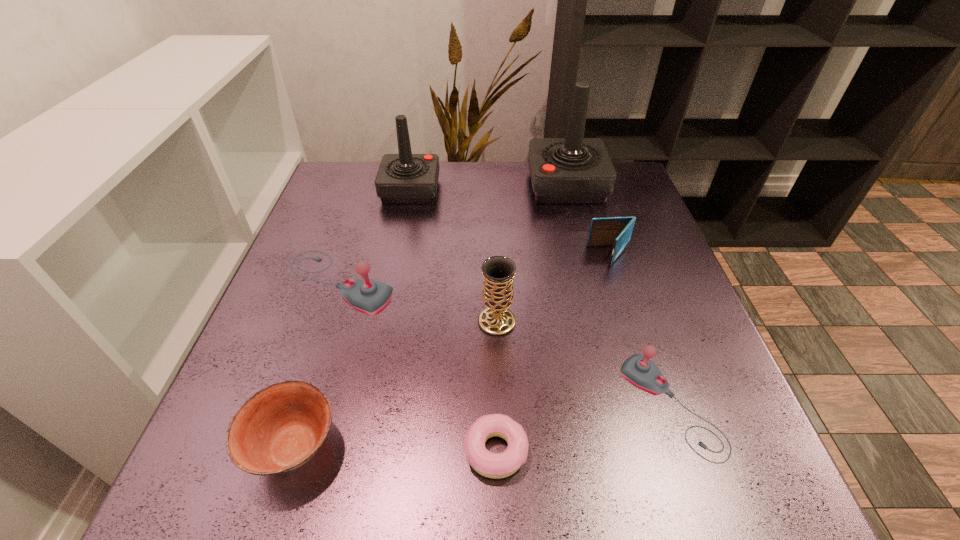
Locate an element on the screen. This screenshot has width=960, height=540. vacant region between the second tallest joystick and the third tallest object is located at coordinates (453, 255).

Find the location of a particular element. Image resolution: width=960 pixels, height=540 pixels. empty space that is in between the tallest joystick and the wallet is located at coordinates (588, 220).

In order to click on free space between the third shortest joystick and the right red joystick in this screenshot , I will do `click(489, 187)`.

Locate an element on the screen. The width and height of the screenshot is (960, 540). free space that is in between the blue wallet and the second shortest joystick is located at coordinates (475, 269).

Locate an element on the screen. This screenshot has width=960, height=540. free space between the bigger red joystick and the bowl is located at coordinates point(431,316).

Image resolution: width=960 pixels, height=540 pixels. Identify the location of vacant region between the smaller gray joystick and the shortest object. (583, 429).

Locate an element on the screen. The image size is (960, 540). free point between the sixth shortest object and the doughnut is located at coordinates (496, 386).

The height and width of the screenshot is (540, 960). What are the coordinates of `free spot between the wallet and the third tallest object` in the screenshot? It's located at (554, 288).

At what (x,y) coordinates should I click in order to perform the action: click on free space between the wallet and the smaller red joystick. Please return your answer as a coordinate pair (x, y). Looking at the image, I should click on (511, 222).

Select which object is the seventh closest to the doughnut. Please provide its 2D coordinates. Your answer should be formatted as a tuple, i.e. [(x, y)], where the tuple contains the x and y coordinates of a point satisfying the conditions above.

[(405, 178)]